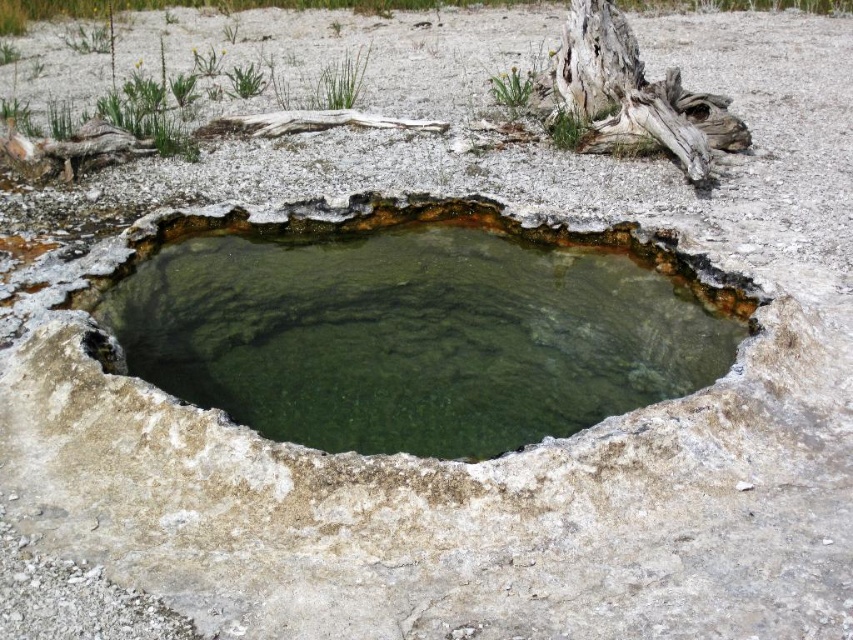
Question: Which point appears farthest from the camera in this image?

Choices:
 (A) (704, 132)
 (B) (260, 92)

Answer: (B)

Question: Is green stone pond at center bigger than green algae at upper center?

Choices:
 (A) yes
 (B) no

Answer: (A)

Question: Observing the image, what is the correct spatial positioning of green leafy algae at upper center in reference to green algae at upper center?

Choices:
 (A) below
 (B) above

Answer: (B)

Question: Among these points, which one is nearest to the camera?

Choices:
 (A) (254, 81)
 (B) (621, 81)

Answer: (B)

Question: Is green grass at upper center to the left of green algae at upper center from the viewer's perspective?

Choices:
 (A) no
 (B) yes

Answer: (B)

Question: Which object is positioned farthest from the green grass at upper center?

Choices:
 (A) gray weathered wood at upper center
 (B) green leafy algae at upper center
 (C) green algae at upper center

Answer: (A)